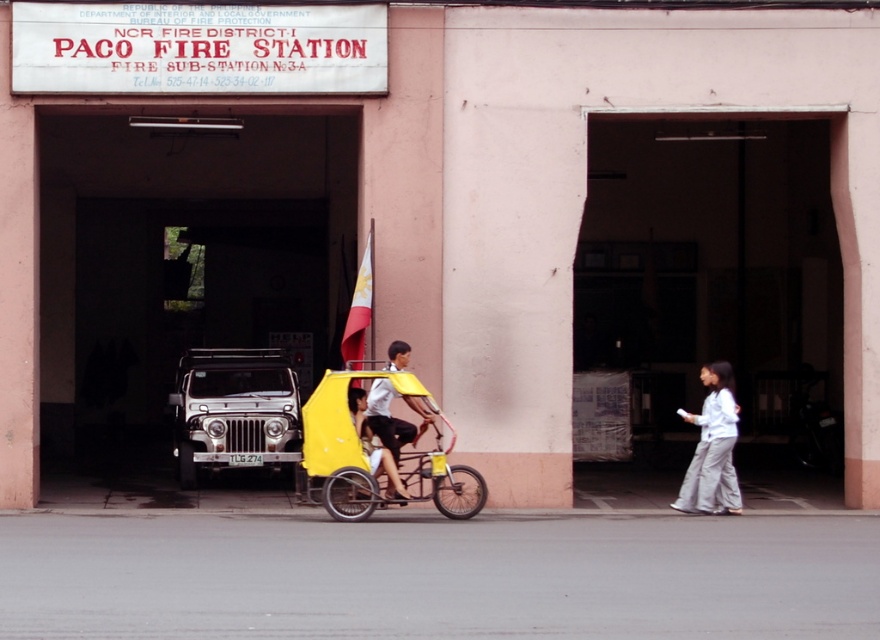
You are a delivery person trying to park your vehicle in front of the Paco Fire Station. The parking space available is only big enough for vehicles smaller than the metallic silver jeep at center. Can your white fabric pants at lower right fit in the parking space?

The metallic silver jeep at center is larger than the white fabric pants at lower right, so the white fabric pants at lower right can fit in the parking space since it is smaller than the jeep.